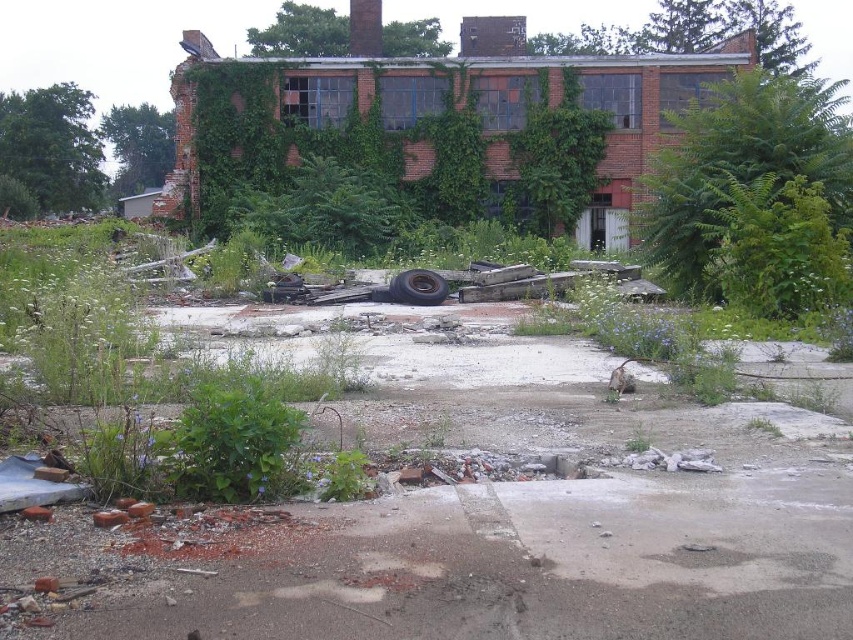
Question: Which of the following is the farthest from the observer?

Choices:
 (A) (57, 113)
 (B) (683, 154)
 (C) (436, 301)

Answer: (A)

Question: Considering the real-world distances, which object is farthest from the green leafy tree at left?

Choices:
 (A) black rubber tire at center
 (B) green leafy plant at upper right

Answer: (A)

Question: Does green leafy tree at left have a lesser width compared to black rubber tire at center?

Choices:
 (A) no
 (B) yes

Answer: (A)

Question: Can you confirm if green leafy plant at upper right is thinner than black rubber tire at center?

Choices:
 (A) yes
 (B) no

Answer: (B)

Question: Does green leafy plant at upper right come in front of black rubber tire at center?

Choices:
 (A) yes
 (B) no

Answer: (A)

Question: Estimate the real-world distances between objects in this image. Which object is closer to the green leafy plant at upper right?

Choices:
 (A) black rubber tire at center
 (B) green leafy tree at left

Answer: (A)